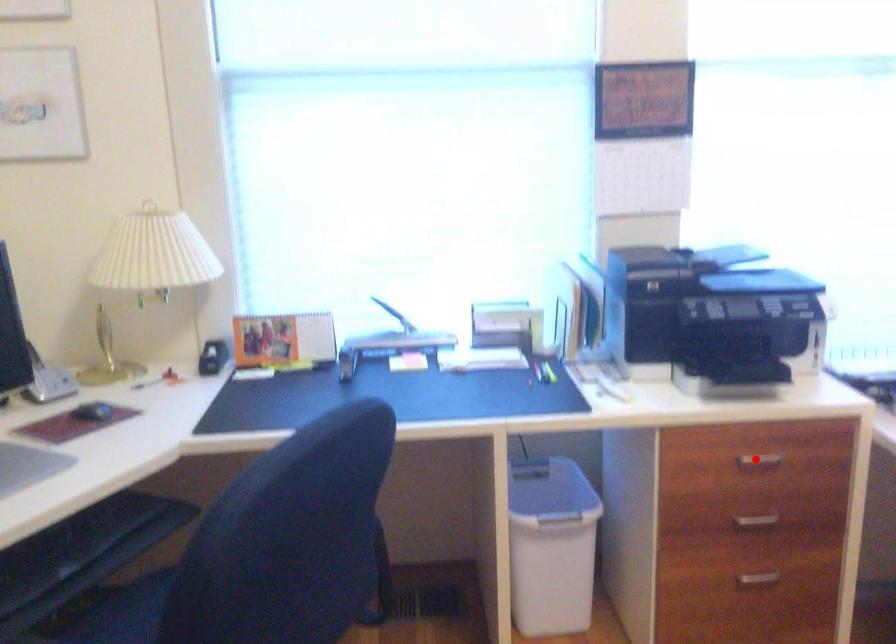
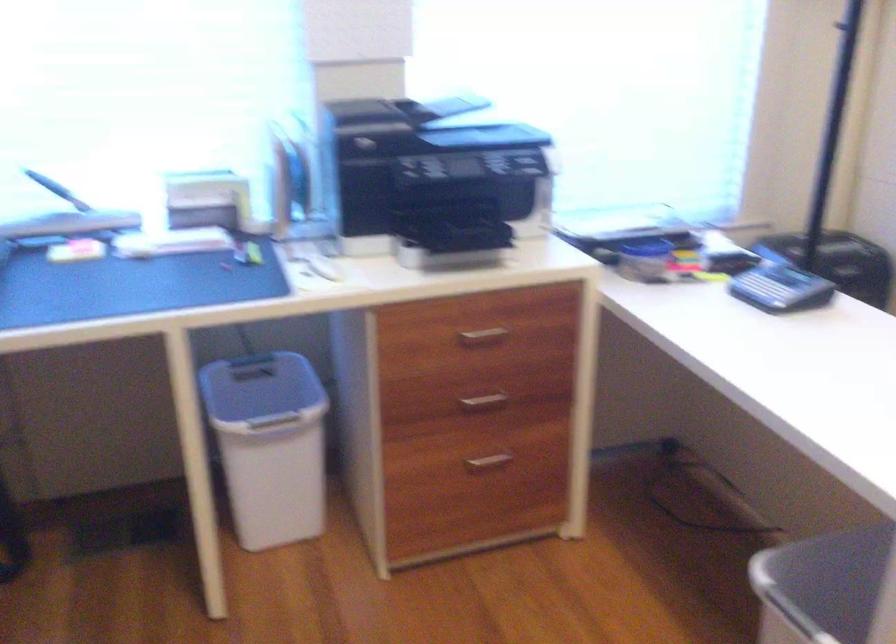
Locate, in the second image, the point that corresponds to the highlighted location in the first image.

(483, 334)